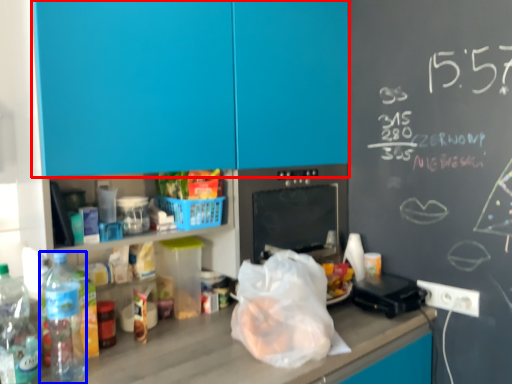
Question: Which point is closer to the camera, cabinetry (highlighted by a red box) or bottle (highlighted by a blue box)?

Choices:
 (A) cabinetry
 (B) bottle

Answer: (A)